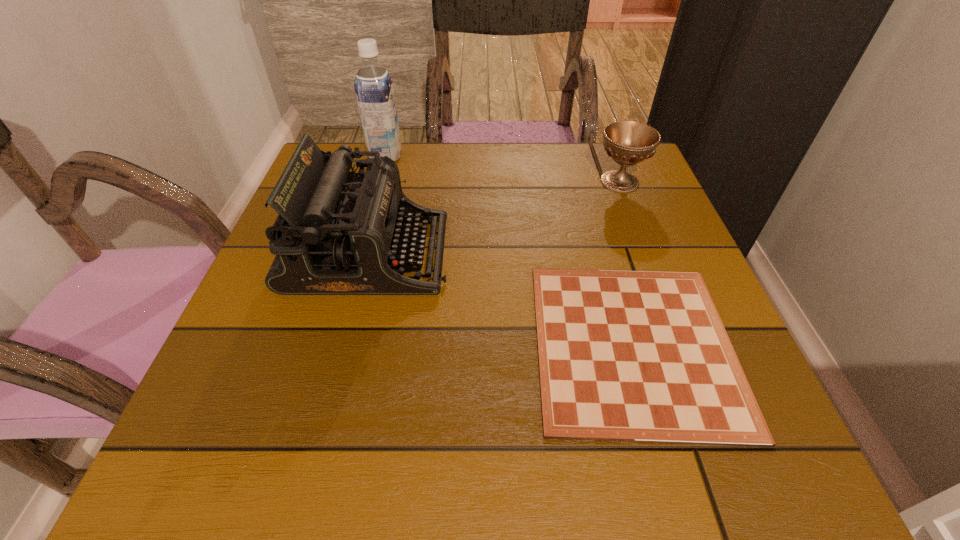
The height and width of the screenshot is (540, 960). I want to click on the farthest object, so click(x=374, y=90).

What are the coordinates of `the tallest object` in the screenshot? It's located at [x=374, y=90].

You are a GUI agent. You are given a task and a screenshot of the screen. Output one action in this format:
    pyautogui.click(x=<x>, y=<y>)
    Task: Click on the typewriter
    The width and height of the screenshot is (960, 540).
    Given the screenshot: What is the action you would take?
    pyautogui.click(x=338, y=232)

You are a GUI agent. You are given a task and a screenshot of the screen. Output one action in this format:
    pyautogui.click(x=<x>, y=<y>)
    Task: Click on the chalice
    This screenshot has height=540, width=960.
    Given the screenshot: What is the action you would take?
    pyautogui.click(x=627, y=142)

Identify the location of the second shortest object. (627, 142).

The image size is (960, 540). What are the coordinates of `the shortest object` in the screenshot? It's located at (634, 356).

The width and height of the screenshot is (960, 540). I want to click on vacant space located on the label of the farthest object, so click(x=425, y=156).

What are the coordinates of `free location located 0.280m on the keyboard of the third shortest object` in the screenshot? It's located at (589, 253).

You are a GUI agent. You are given a task and a screenshot of the screen. Output one action in this format:
    pyautogui.click(x=<x>, y=<y>)
    Task: Click on the free point located on the front of the chalice
    This screenshot has width=960, height=540.
    Given the screenshot: What is the action you would take?
    pyautogui.click(x=674, y=321)

Find the location of a particular element. vacant space situated on the left of the checkerboard is located at coordinates (394, 345).